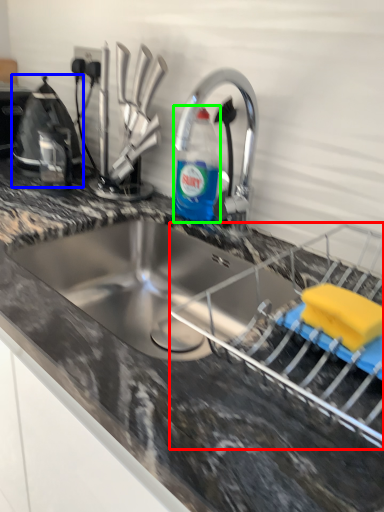
Question: Based on their relative distances, which object is nearer to appliance (highlighted by a red box)? Choose from appliance (highlighted by a blue box) and bottle (highlighted by a green box).

Choices:
 (A) appliance
 (B) bottle

Answer: (B)